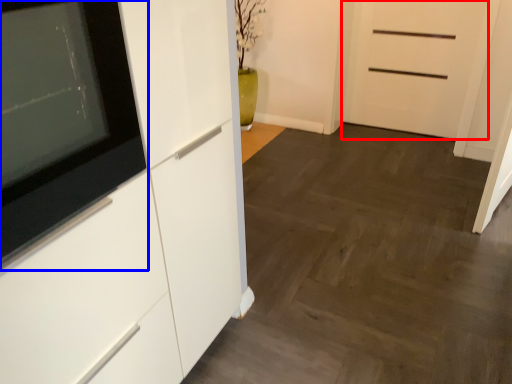
Question: Which object is further to the camera taking this photo, door (highlighted by a red box) or appliance (highlighted by a blue box)?

Choices:
 (A) door
 (B) appliance

Answer: (A)